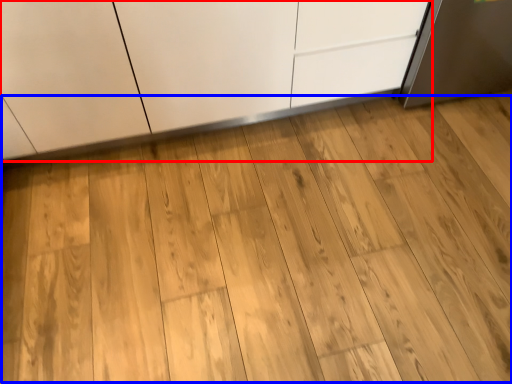
Question: Among these objects, which one is nearest to the camera, cabinetry (highlighted by a red box) or dresser (highlighted by a blue box)?

Choices:
 (A) cabinetry
 (B) dresser

Answer: (B)